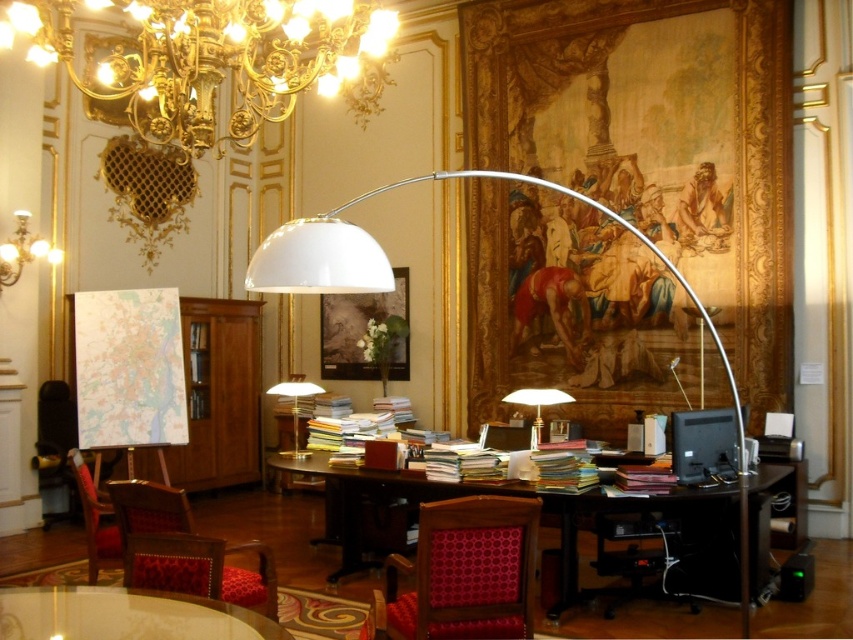
Question: Which of the following is the closest to the observer?

Choices:
 (A) (529, 396)
 (B) (257, 60)
 (C) (334, 532)

Answer: (B)

Question: Is velvet red chair at lower left above matte gold chandelier at upper left?

Choices:
 (A) no
 (B) yes

Answer: (A)

Question: Which point appears closest to the camera in this image?

Choices:
 (A) (238, 424)
 (B) (488, 612)
 (C) (164, 496)

Answer: (B)

Question: Can you confirm if gold metallic chandelier at upper left is positioned below white matte arc lamp at center?

Choices:
 (A) yes
 (B) no

Answer: (B)

Question: Does yellowish paper stack at right appear on the left side of white glossy table lamp at center?

Choices:
 (A) no
 (B) yes

Answer: (B)

Question: Which object is positioned closest to the yellowish paper stack at right?

Choices:
 (A) wooden desk at center
 (B) white matte arc lamp at center

Answer: (A)